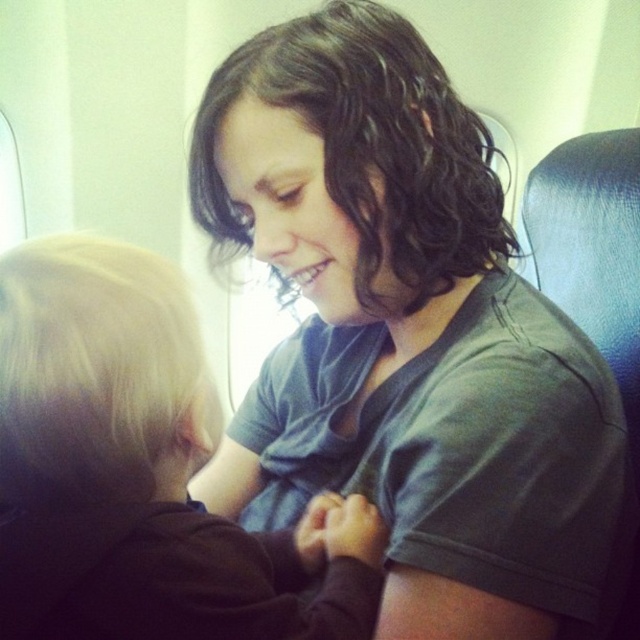
You are a flight attendant checking seatbelts before takeoff. You see the dark green fabric shirt at center and the dark brown hair at upper center. Which one is taller?

The dark green fabric shirt at center is much taller than the dark brown hair at upper center.

Consider the image. What is the 2D coordinate of the dark green fabric shirt at center?

The dark green fabric shirt at center is located at the 2D coordinate point of (406, 339).

You are an airplane seat designer who needs to ensure there is enough space between the seats for passengers. You observe the dark green fabric shirt at center and the dark brown hair at upper center in the image. Which object takes up more space in the scene?

The dark green fabric shirt at center takes up more space in the scene because it is bigger than the dark brown hair at upper center according to the description.